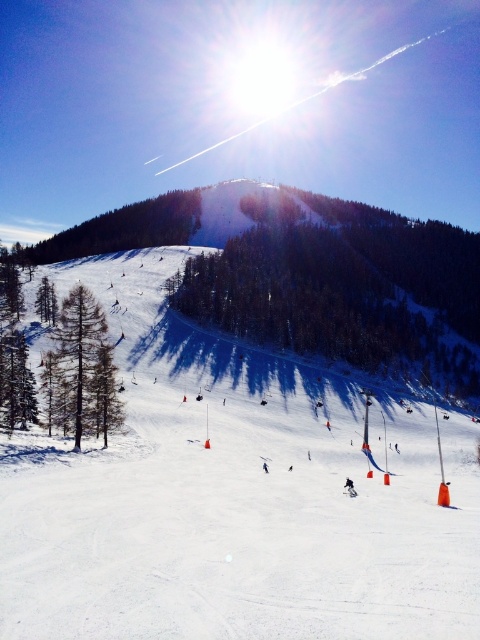
Question: Which object is the closest to the green textured tree at center?

Choices:
 (A) white snow ski slope at center
 (B) white matte ski at center
 (C) brown matte tree at left

Answer: (A)

Question: Based on their relative distances, which object is nearer to the white snow ski slope at center?

Choices:
 (A) green matte tree at left
 (B) green textured tree at center
 (C) green matte tree at upper left

Answer: (A)

Question: Does white snow ski slope at center come in front of green matte tree at upper left?

Choices:
 (A) no
 (B) yes

Answer: (B)

Question: Which object is the farthest from the green matte tree at upper left?

Choices:
 (A) white snow ski slope at center
 (B) green matte tree at left

Answer: (B)

Question: Does black snowboarder at center have a greater width compared to white matte ski at center?

Choices:
 (A) yes
 (B) no

Answer: (A)

Question: Is green textured tree at center bigger than white matte ski at center?

Choices:
 (A) no
 (B) yes

Answer: (B)